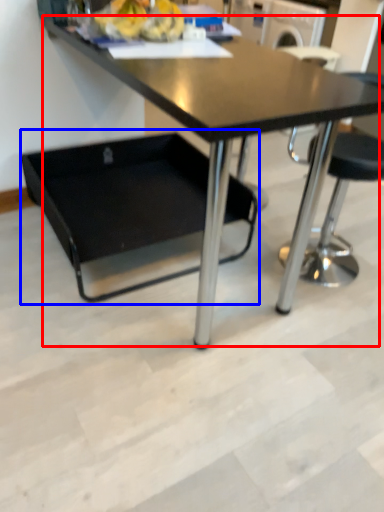
Question: Which object appears farthest to the camera in this image, table (highlighted by a red box) or swivel chair (highlighted by a blue box)?

Choices:
 (A) table
 (B) swivel chair

Answer: (B)